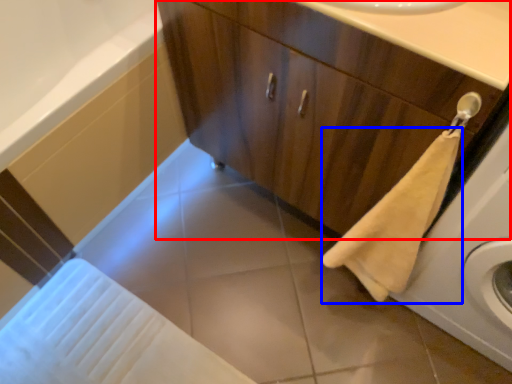
Question: Which object appears farthest to the camera in this image, bathroom cabinet (highlighted by a red box) or bath towel (highlighted by a blue box)?

Choices:
 (A) bathroom cabinet
 (B) bath towel

Answer: (A)